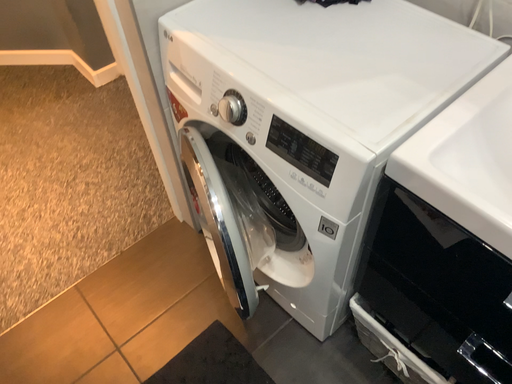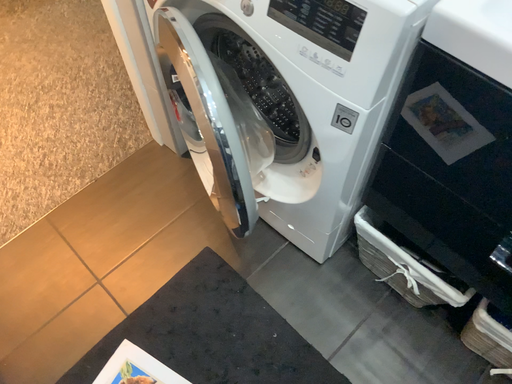
Question: How did the camera likely rotate when shooting the video?

Choices:
 (A) rotated downward
 (B) rotated upward

Answer: (A)